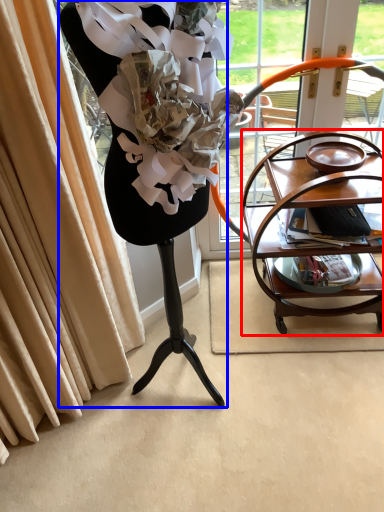
Question: Which object appears closest to the camera in this image, table (highlighted by a red box) or furniture (highlighted by a blue box)?

Choices:
 (A) table
 (B) furniture

Answer: (B)